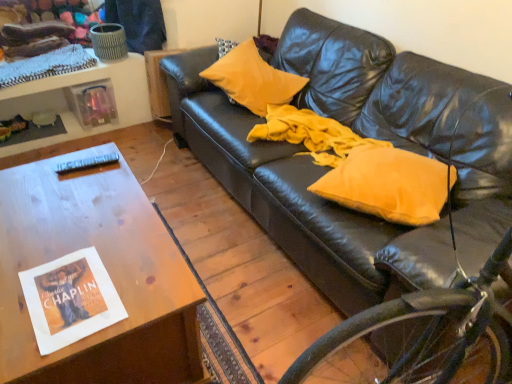
Locate an element on the screen. spots to the right of white paper magazine at lower left is located at coordinates pos(145,281).